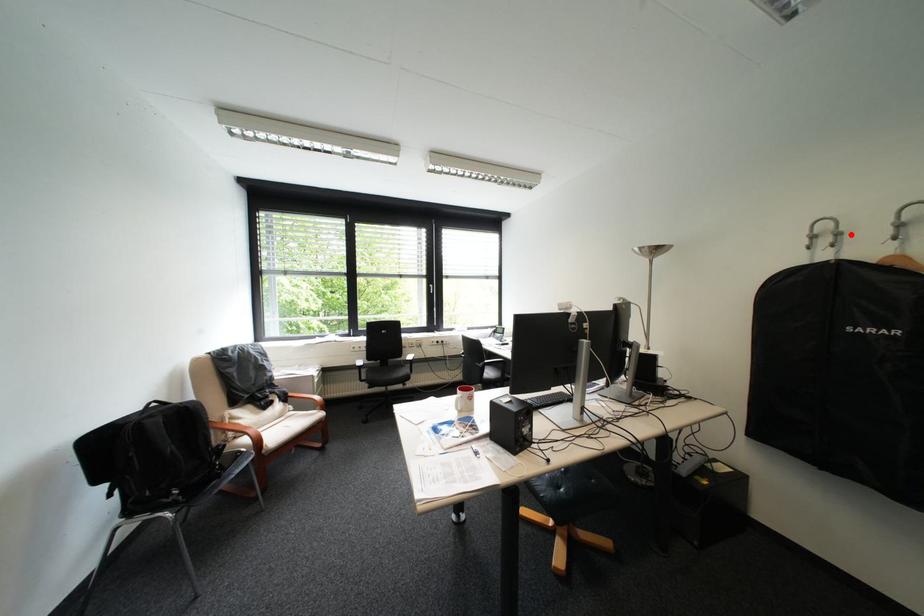
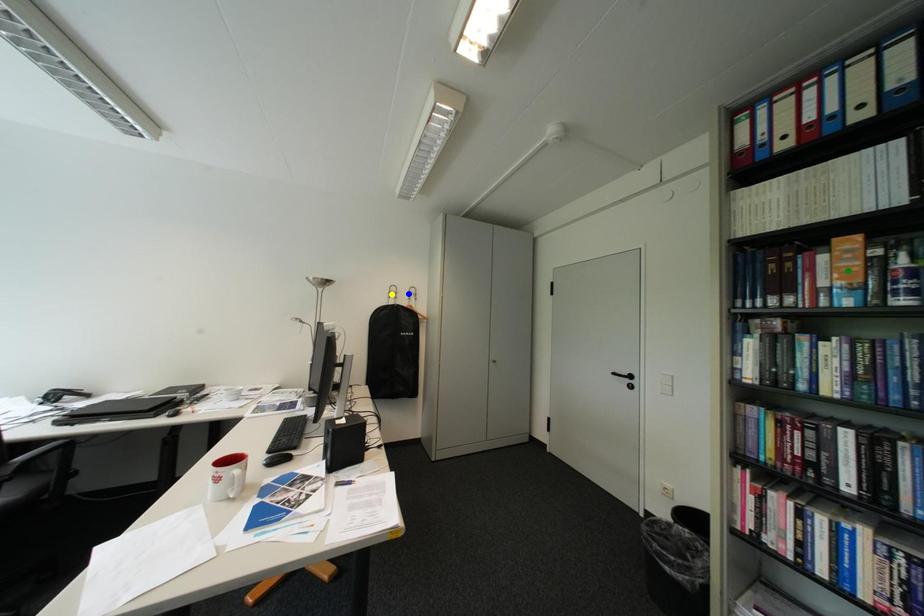
Question: I am providing you with two images of the same scene from different viewpoints. A red point is marked on the first image. You are given multiple points on the second image. Can you choose the point in image 2 that corresponds to the point in image 1?

Choices:
 (A) green point
 (B) blue point
 (C) yellow point

Answer: (B)